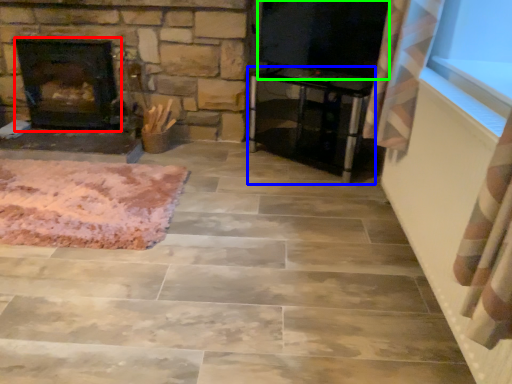
Question: Which object is the farthest from fireplace (highlighted by a red box)? Choose among these: furniture (highlighted by a blue box) or window screen (highlighted by a green box).

Choices:
 (A) furniture
 (B) window screen

Answer: (B)